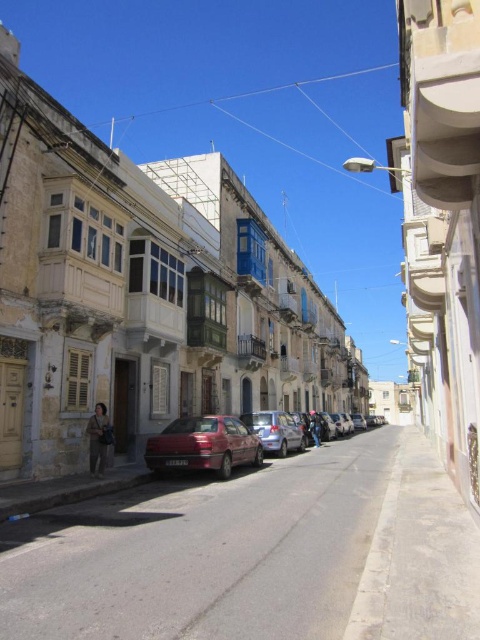
Question: Can you confirm if shiny red car at center is positioned to the left of metallic silver car at center?

Choices:
 (A) yes
 (B) no

Answer: (A)

Question: Which point appears closest to the camera in this image?

Choices:
 (A) (285, 428)
 (B) (173, 445)

Answer: (B)

Question: Does shiny red car at center have a larger size compared to metallic silver car at center?

Choices:
 (A) no
 (B) yes

Answer: (B)

Question: Can you confirm if shiny red car at center is bigger than metallic silver car at center?

Choices:
 (A) yes
 (B) no

Answer: (A)

Question: Which point appears closest to the camera in this image?

Choices:
 (A) coord(156,451)
 (B) coord(282,426)

Answer: (A)